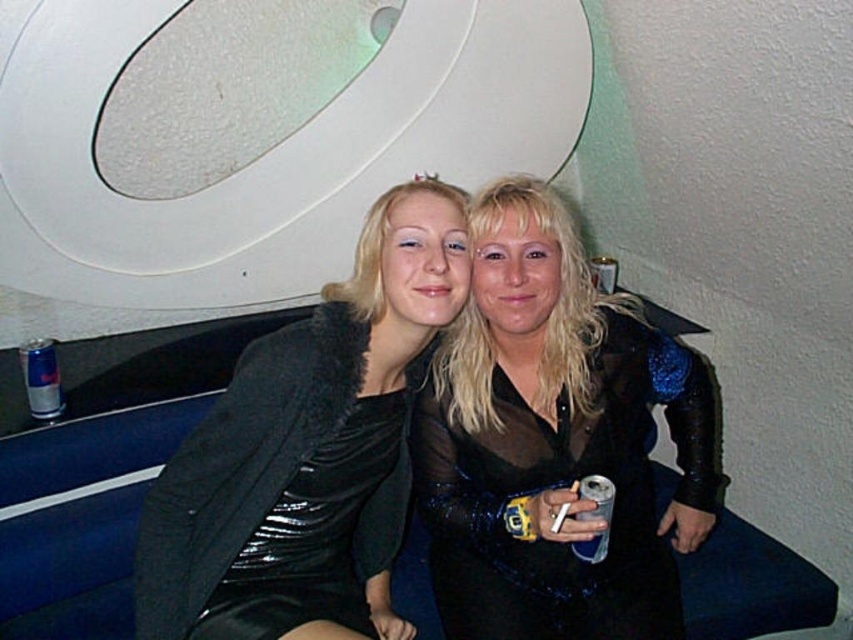
You are a photographer standing at a distance of 4 feet from the velvet black dress at center. Can you capture a clear closeup shot of the dress without moving closer?

The velvet black dress at center is 4.19 feet away from the camera. Since you are standing at 4 feet, you are slightly farther than the dress, so you can capture a clear closeup shot without moving closer.